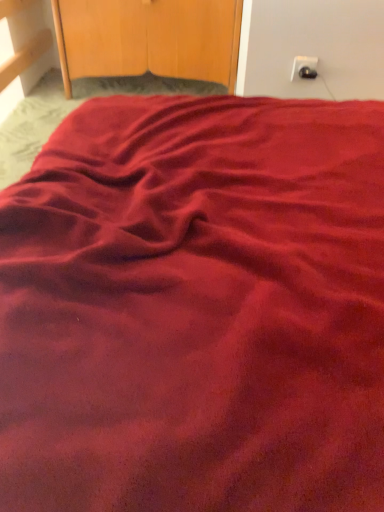
Question: From a real-world perspective, is wooden dresser at upper center physically located above or below black plastic outlet at upper right?

Choices:
 (A) above
 (B) below

Answer: (B)

Question: Considering their positions, is wooden dresser at upper center located in front of or behind black plastic outlet at upper right?

Choices:
 (A) front
 (B) behind

Answer: (B)

Question: Considering the positions of wooden dresser at upper center and black plastic outlet at upper right in the image, is wooden dresser at upper center wider or thinner than black plastic outlet at upper right?

Choices:
 (A) wide
 (B) thin

Answer: (A)

Question: In terms of width, does black plastic outlet at upper right look wider or thinner when compared to wooden dresser at upper center?

Choices:
 (A) wide
 (B) thin

Answer: (B)

Question: Relative to wooden dresser at upper center, is black plastic outlet at upper right in front or behind?

Choices:
 (A) front
 (B) behind

Answer: (A)

Question: Is black plastic outlet at upper right to the left or to the right of wooden dresser at upper center in the image?

Choices:
 (A) right
 (B) left

Answer: (A)

Question: Considering the positions of point [x=304, y=67] and point [x=150, y=37], is point [x=304, y=67] closer or farther from the camera than point [x=150, y=37]?

Choices:
 (A) closer
 (B) farther

Answer: (A)